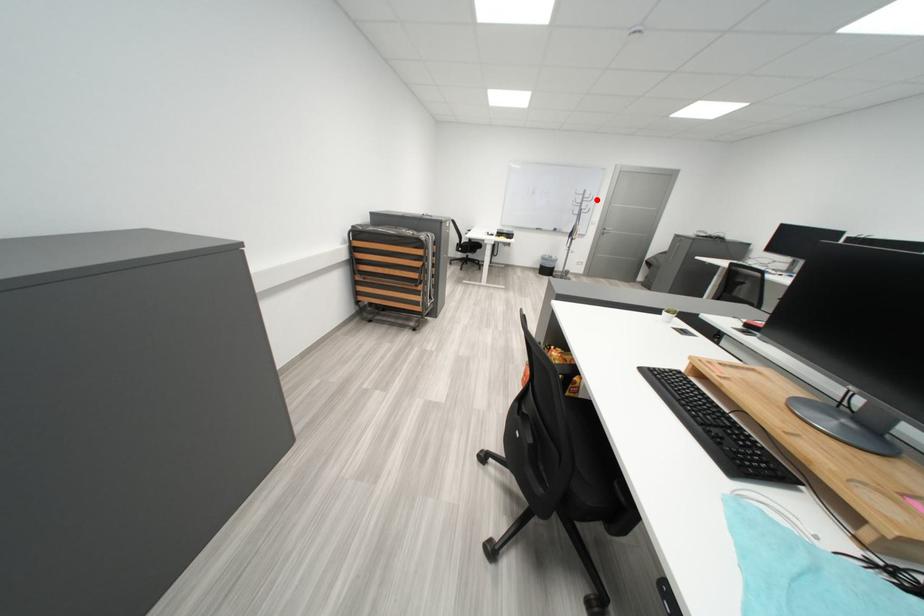
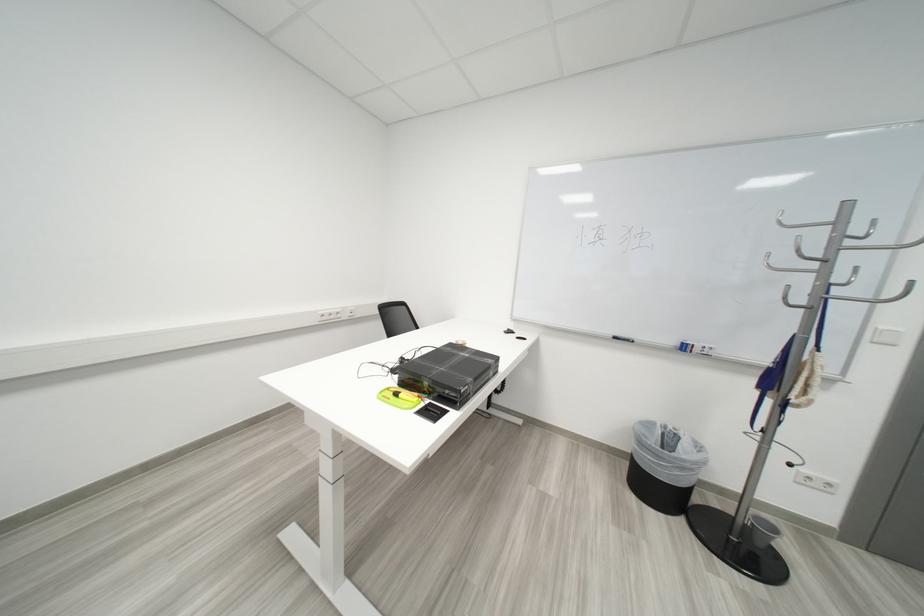
Where in the second image is the point corresponding to the highlighted location from the first image?

(853, 238)